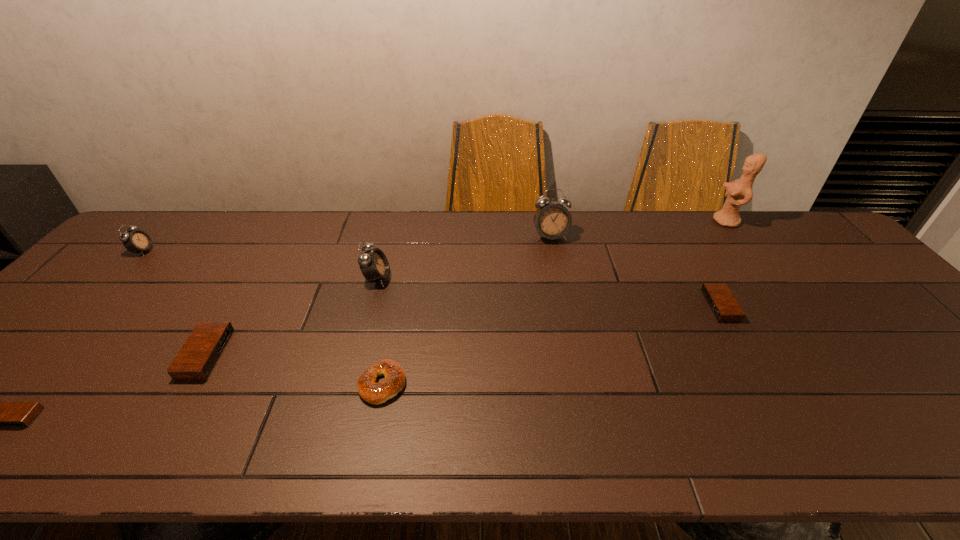
Where is `the rightmost object`? This screenshot has width=960, height=540. the rightmost object is located at coordinates (739, 192).

Locate an element on the screen. This screenshot has height=540, width=960. figurine is located at coordinates (739, 192).

In order to click on the biggest white alarm clock in this screenshot , I will do (x=552, y=220).

You are a GUI agent. You are given a task and a screenshot of the screen. Output one action in this format:
    pyautogui.click(x=<x>, y=<y>)
    Task: Click on the third object from right to left
    
    Given the screenshot: What is the action you would take?
    pyautogui.click(x=552, y=220)

The height and width of the screenshot is (540, 960). I want to click on the fifth shortest alarm clock, so click(x=373, y=263).

I want to click on the third farthest alarm clock, so click(x=373, y=263).

I want to click on the leftmost white alarm clock, so click(x=136, y=240).

At what (x,y) coordinates should I click in order to perform the action: click on the fourth shortest alarm clock. Please return your answer as a coordinate pair (x, y). The image size is (960, 540). Looking at the image, I should click on (136, 240).

Where is `the second nearest alarm clock`? Image resolution: width=960 pixels, height=540 pixels. the second nearest alarm clock is located at coordinates (196, 360).

Find the location of a particular element. The width and height of the screenshot is (960, 540). the fourth alarm clock from right to left is located at coordinates (196, 360).